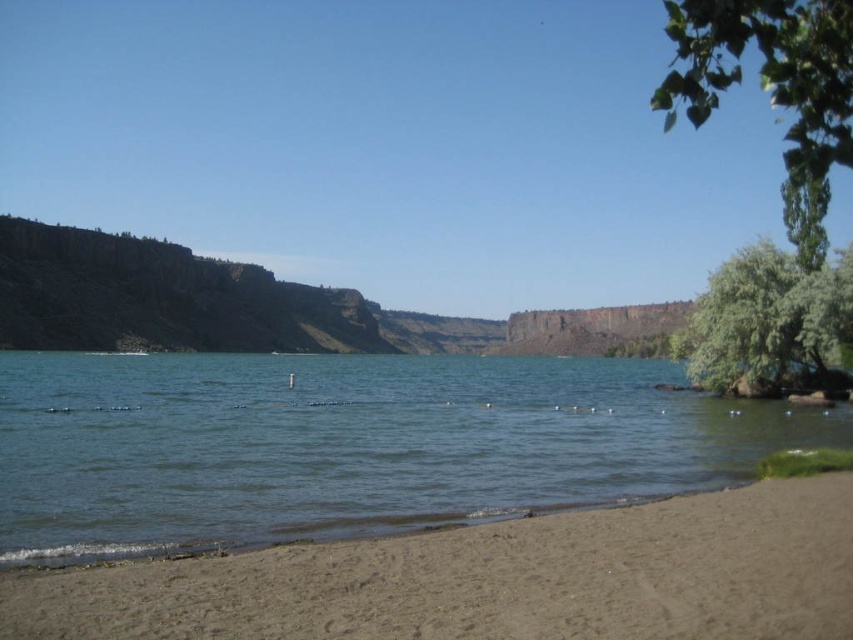
You are standing on the sandy beach and want to take a photo of both the green leafy tree at upper right and the green leafy tree at right. Which tree should you position closer to the edge of the frame to include both in your shot?

You should position the green leafy tree at right closer to the edge of the frame because the green leafy tree at upper right is wider than the green leafy tree at right, allowing more space for both in the photo.